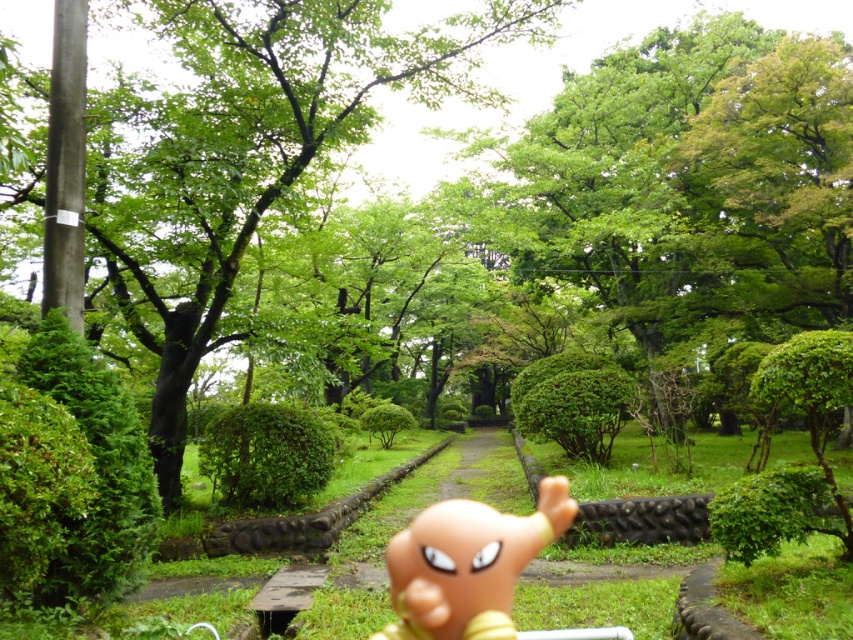
Question: Can you confirm if green leafy tree at center is bigger than matte orange toy at center?

Choices:
 (A) yes
 (B) no

Answer: (A)

Question: Which point is closer to the camera?

Choices:
 (A) matte orange toy at center
 (B) green leafy tree at center

Answer: (A)

Question: Is green leafy tree at center below matte orange toy at center?

Choices:
 (A) yes
 (B) no

Answer: (B)

Question: Which object appears closest to the camera in this image?

Choices:
 (A) matte orange toy at center
 (B) green leafy tree at center

Answer: (A)

Question: Does green leafy tree at center have a greater width compared to matte orange toy at center?

Choices:
 (A) no
 (B) yes

Answer: (B)